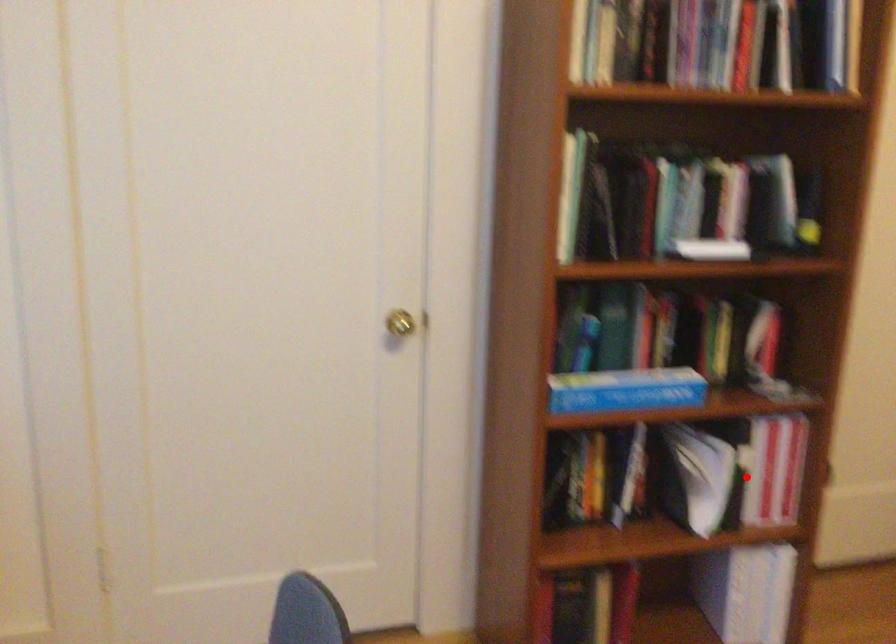
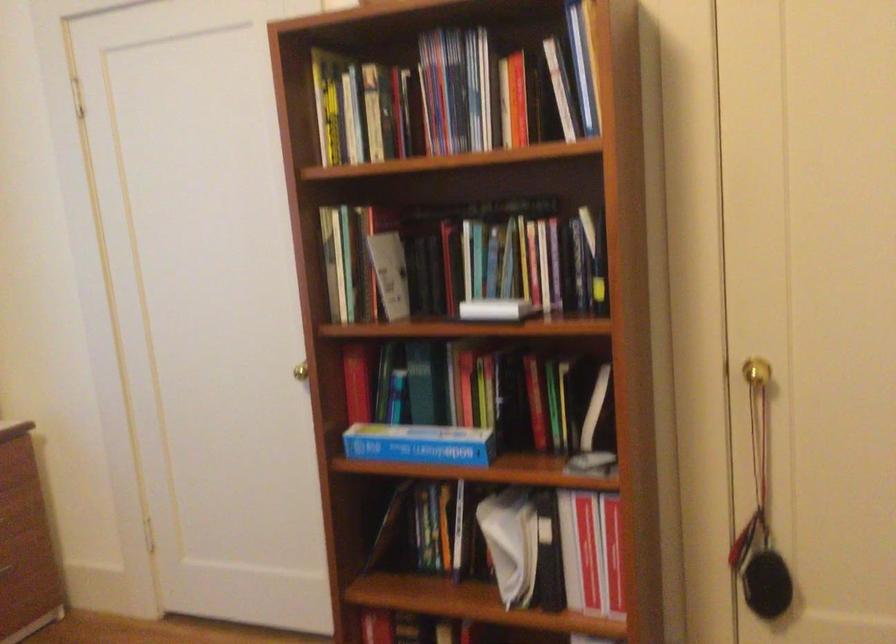
Locate, in the second image, the point that corresponds to the highlighted location in the first image.

(570, 552)